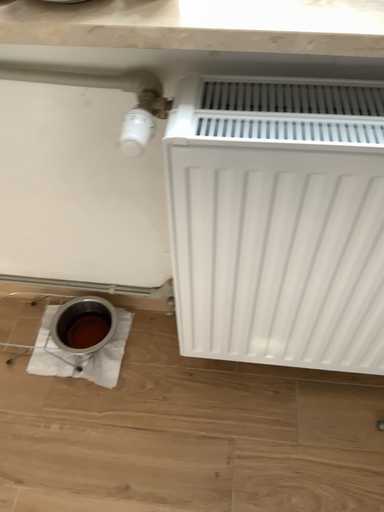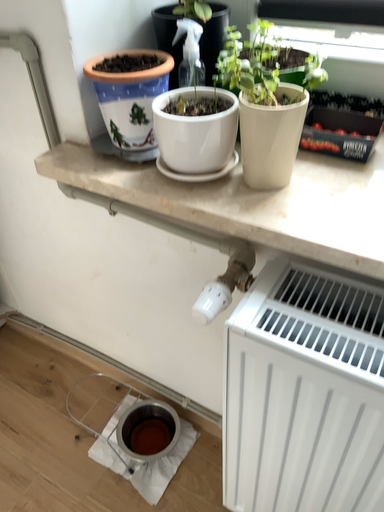
Question: Which way did the camera rotate in the video?

Choices:
 (A) rotated downward
 (B) rotated upward

Answer: (B)